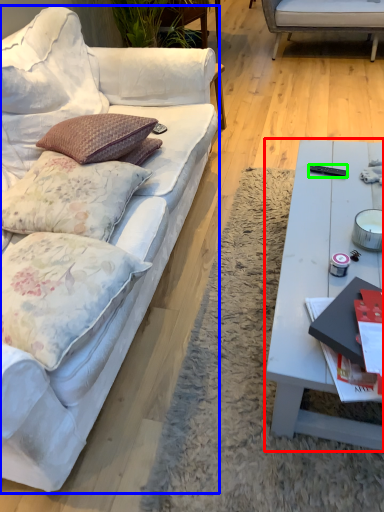
Question: Considering the real-world distances, which object is farthest from coffee table (highlighted by a red box)? studio couch (highlighted by a blue box) or remote control (highlighted by a green box)?

Choices:
 (A) studio couch
 (B) remote control

Answer: (A)